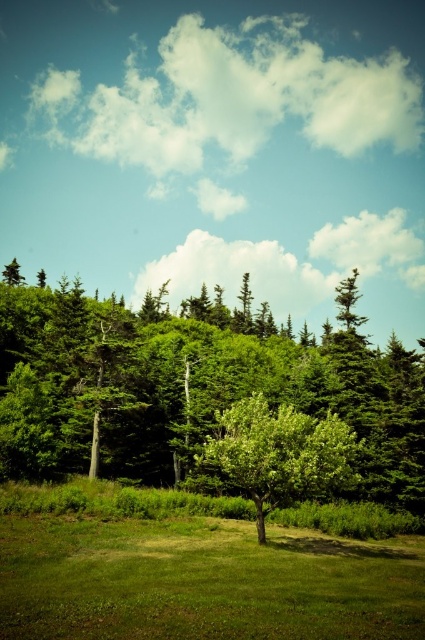
Can you confirm if green leafy trees at center is positioned to the right of green grass at center?

No, green leafy trees at center is not to the right of green grass at center.

Between green leafy trees at center and green grass at center, which one is positioned higher?

green leafy trees at center is higher up.

Who is more distant from viewer, (266,316) or (401,579)?

Point (266,316)

Locate an element on the screen. green leafy trees at center is located at coordinates (204, 397).

Which is behind, point (240, 388) or point (248, 451)?

Positioned behind is point (240, 388).

Looking at this image, between green leafy trees at center and green leafy tree at center, which one is positioned lower?

green leafy tree at center is lower down.

Between point (34, 365) and point (292, 467), which one is positioned in front?

Point (292, 467) is in front.

In order to click on green leafy trees at center in this screenshot , I will do pyautogui.click(x=204, y=397).

Who is lower down, green grass at center or green leafy tree at center?

green grass at center is lower down.

Does point (380, 632) lie behind point (265, 404)?

No, it is in front of (265, 404).

Consider the image. Who is more forward, (156, 536) or (265, 468)?

Positioned in front is point (265, 468).

Where is `green grass at center`? The width and height of the screenshot is (425, 640). green grass at center is located at coordinates (204, 582).